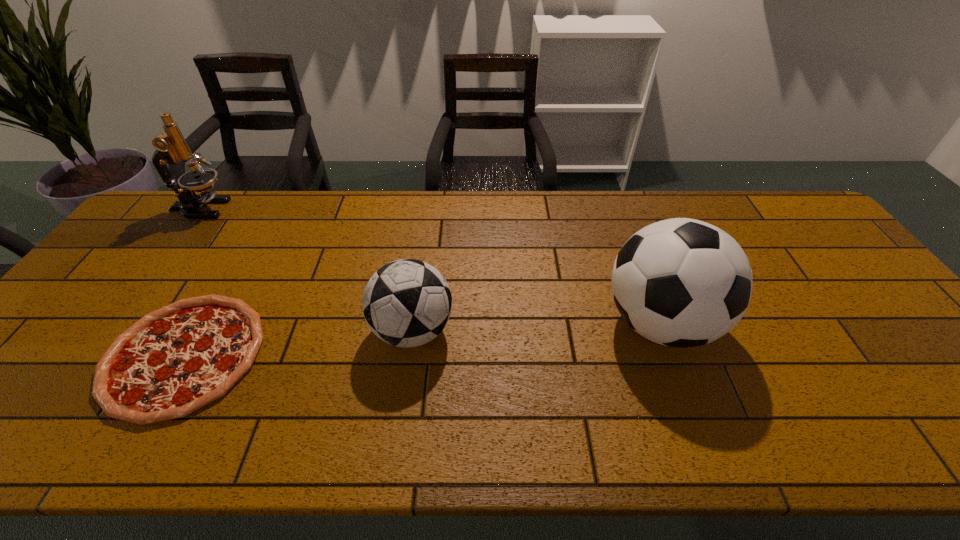
At what (x,y) coordinates should I click in order to perform the action: click on object situated at the far edge. Please return your answer as a coordinate pair (x, y). Looking at the image, I should click on (171, 147).

Identify the location of object that is at the near edge. (175, 360).

Where is `object positioned at the left edge`? Image resolution: width=960 pixels, height=540 pixels. object positioned at the left edge is located at coordinates tap(171, 147).

Locate an element on the screen. This screenshot has height=540, width=960. object positioned at the far left corner is located at coordinates (171, 147).

In the image, there is a desktop. Identify the location of vacant space at the far edge. (490, 191).

The image size is (960, 540). I want to click on vacant space at the near edge of the desktop, so click(399, 415).

Locate an element on the screen. vacant space at the right edge of the desktop is located at coordinates (813, 261).

Find the location of a particular element. This screenshot has width=960, height=540. free space between the microscope and the left soccer ball is located at coordinates (307, 270).

Where is `vacant area that lies between the third object from left to right and the farthest object`? The image size is (960, 540). vacant area that lies between the third object from left to right and the farthest object is located at coordinates pos(307,270).

Where is `empty location between the shortest object and the microscope`? Image resolution: width=960 pixels, height=540 pixels. empty location between the shortest object and the microscope is located at coordinates (193, 282).